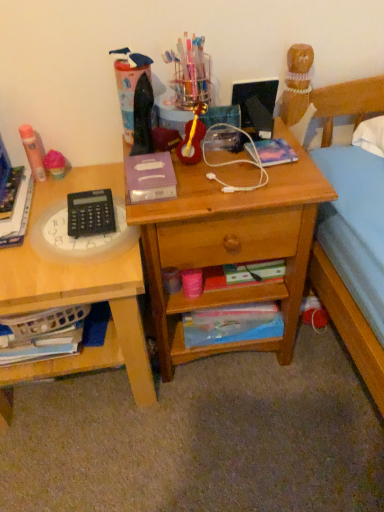
The image size is (384, 512). Identify the location of vacant location behind black plastic calculator at left. (81, 179).